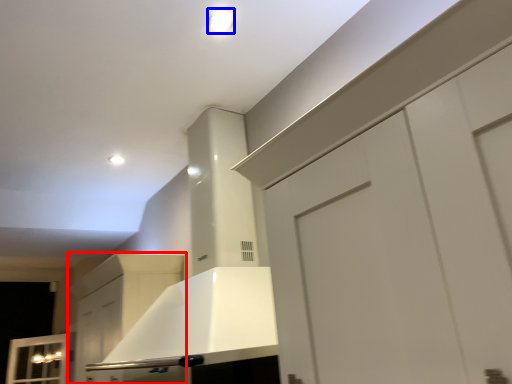
Question: Which object appears closest to the camera in this image, cabinetry (highlighted by a red box) or lighting (highlighted by a blue box)?

Choices:
 (A) cabinetry
 (B) lighting

Answer: (B)